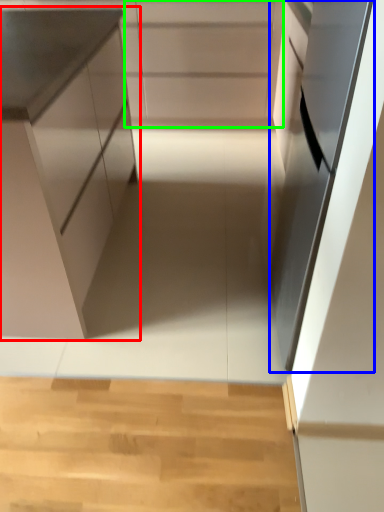
Question: Based on their relative distances, which object is nearer to cabinetry (highlighted by a red box)? Choose from oven (highlighted by a blue box) and cabinetry (highlighted by a green box).

Choices:
 (A) oven
 (B) cabinetry

Answer: (A)